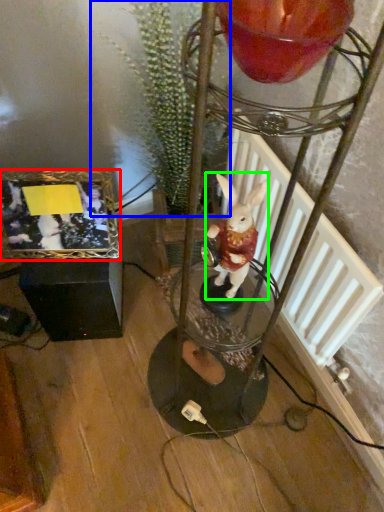
Question: Estimate the real-world distances between objects in this image. Which object is closer to picture frame (highlighted by a red box), plant (highlighted by a blue box) or rabbit (highlighted by a green box)?

Choices:
 (A) plant
 (B) rabbit

Answer: (A)